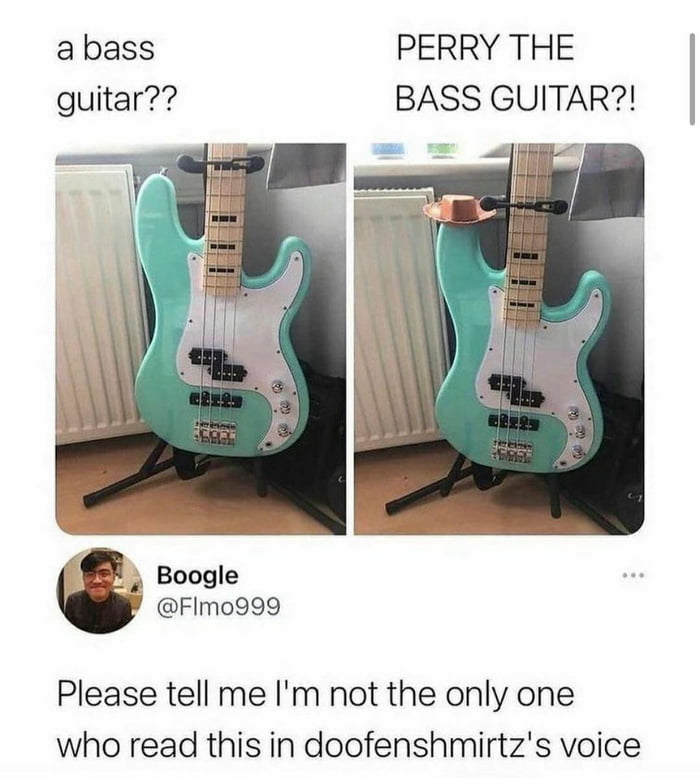
I want to click on drapes, so click(600, 184).